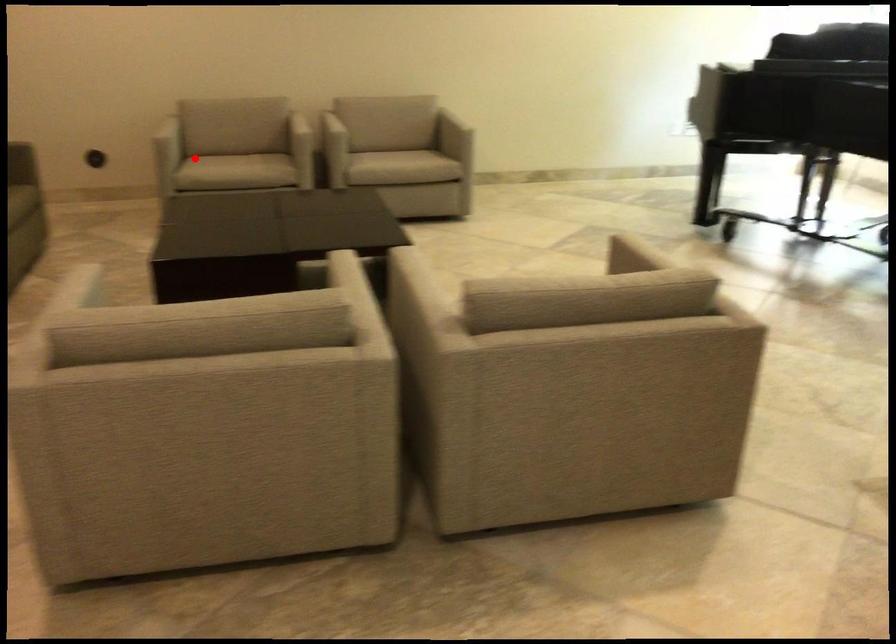
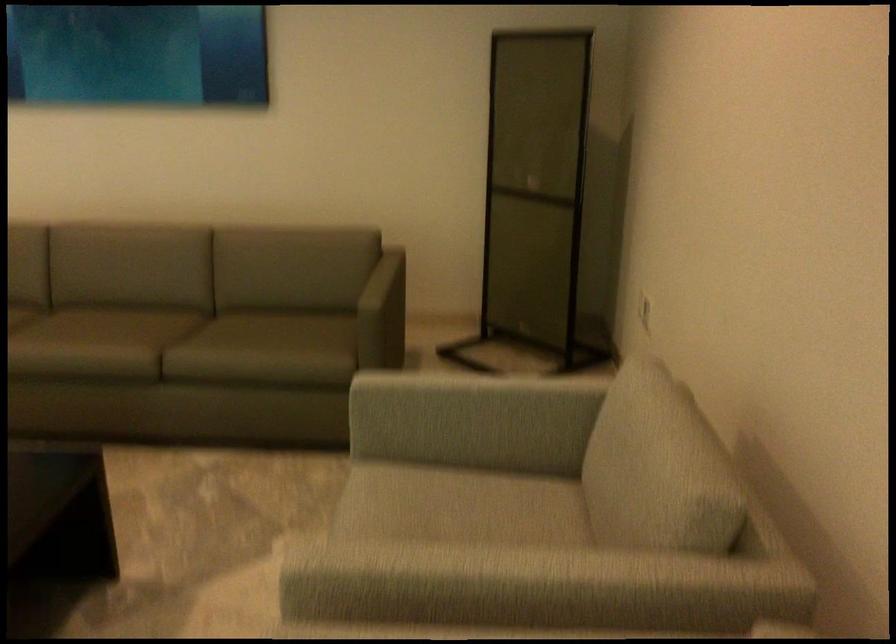
Question: I am providing you with two images of the same scene from different viewpoints. Given a red point in image1, look at the same physical point in image2. Is it:

Choices:
 (A) Closer to the viewpoint
 (B) Farther from the viewpoint

Answer: (A)